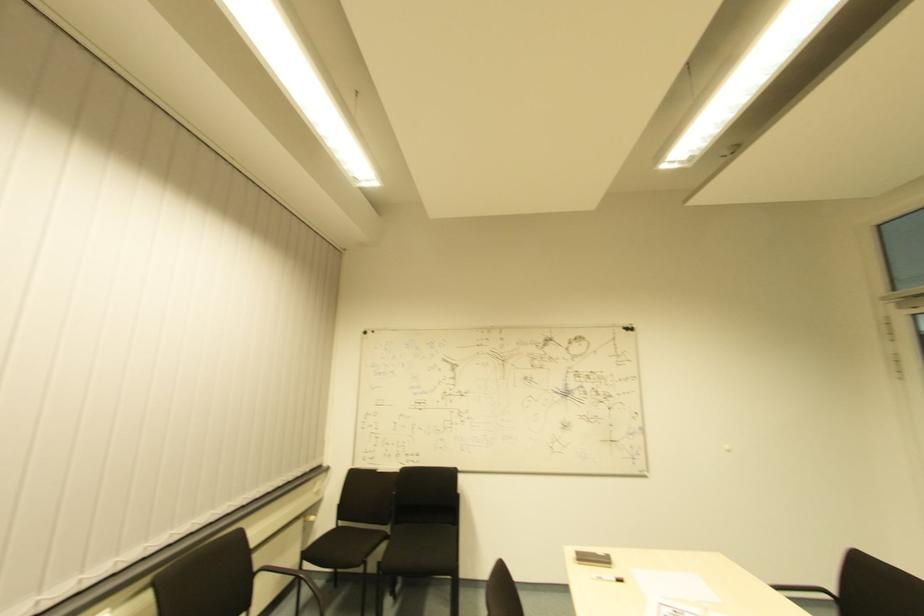
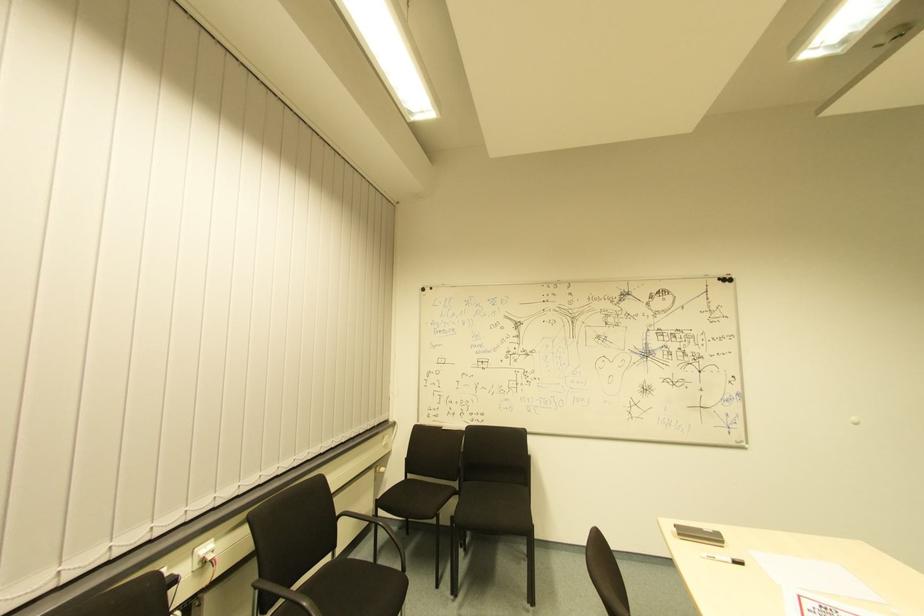
Question: I am providing you with two images of the same scene from different viewpoints. Which of the following objects are not visible in image2?

Choices:
 (A) black chair armrest
 (B) black chair sitting surface
 (C) whiteboard marker
 (D) none of these

Answer: (D)